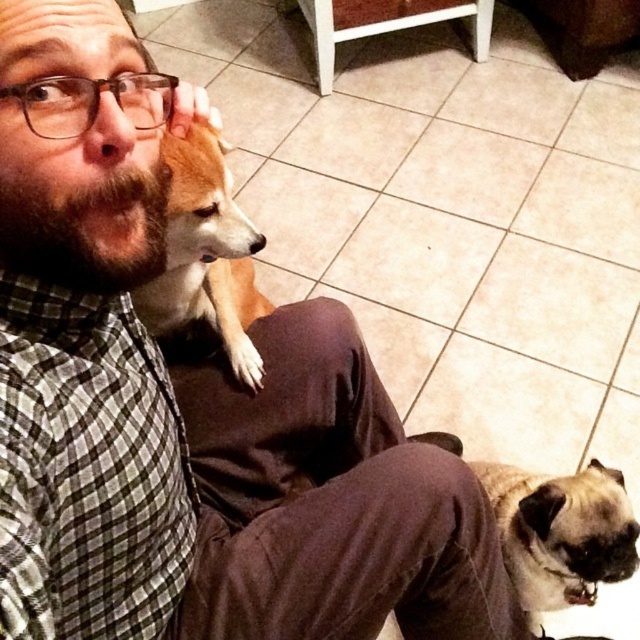
Based on the photo, can you confirm if light brown fur at upper left is thinner than fuzzy beige dog at lower right?

Incorrect, light brown fur at upper left's width is not less than fuzzy beige dog at lower right's.

Looking at this image, between light brown fur at upper left and fuzzy beige dog at lower right, which one appears on the right side from the viewer's perspective?

fuzzy beige dog at lower right

Locate an element on the screen. The image size is (640, 640). light brown fur at upper left is located at coordinates tap(205, 253).